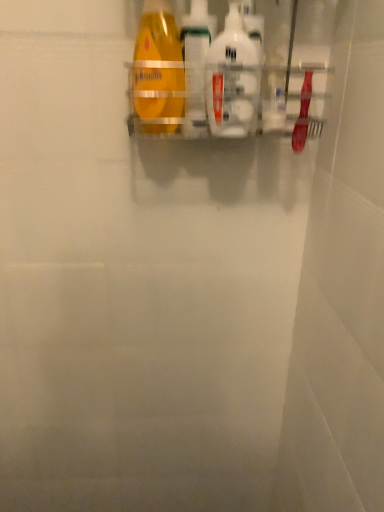
What is the approximate height of translucent plastic bottle at center, which is the second cleaning product in right-to-left order?

The height of translucent plastic bottle at center, which is the second cleaning product in right-to-left order, is 8.29 inches.

At what (x,y) coordinates should I click in order to perform the action: click on white glossy bottle at center, which appears as the 1th cleaning product when viewed from the right. Please return your answer as a coordinate pair (x, y). The image size is (384, 512). Looking at the image, I should click on (232, 79).

Describe the element at coordinates (158, 68) in the screenshot. This screenshot has width=384, height=512. I see `yellow matte bottle at upper center` at that location.

Locate an element on the screen. The height and width of the screenshot is (512, 384). translucent plastic bottle at center, the 1th cleaning product in the left-to-right sequence is located at coordinates (196, 65).

Would you say translucent plastic bottle at center, the 1th cleaning product in the left-to-right sequence, is inside or outside yellow matte bottle at upper center?

translucent plastic bottle at center, the 1th cleaning product in the left-to-right sequence, is spatially situated outside yellow matte bottle at upper center.

Can you tell me how much translucent plastic bottle at center, the 1th cleaning product in the left-to-right sequence, and yellow matte bottle at upper center differ in facing direction?

translucent plastic bottle at center, the 1th cleaning product in the left-to-right sequence, and yellow matte bottle at upper center are facing 45 degrees away from each other.

This screenshot has width=384, height=512. In order to click on bottle in front of the translucent plastic bottle at center, the 1th cleaning product in the left-to-right sequence in this screenshot , I will do `click(158, 68)`.

Is point (203, 60) positioned in front of point (145, 71)?

No, (203, 60) is behind (145, 71).

Can you confirm if yellow matte bottle at upper center is shorter than white glossy bottle at center, the second cleaning product in the left-to-right sequence?

No, yellow matte bottle at upper center is not shorter than white glossy bottle at center, the second cleaning product in the left-to-right sequence.

Considering the sizes of yellow matte bottle at upper center and white glossy bottle at center, the second cleaning product in the left-to-right sequence, in the image, is yellow matte bottle at upper center wider or thinner than white glossy bottle at center, the second cleaning product in the left-to-right sequence,?

In the image, yellow matte bottle at upper center appears to be wider than white glossy bottle at center, the second cleaning product in the left-to-right sequence.

Is yellow matte bottle at upper center aimed at white glossy bottle at center, which appears as the 1th cleaning product when viewed from the right?

No, yellow matte bottle at upper center does not turn towards white glossy bottle at center, which appears as the 1th cleaning product when viewed from the right.

Does point (160, 36) appear closer or farther from the camera than point (225, 27)?

Point (160, 36) is farther from the camera than point (225, 27).

From a real-world perspective, relative to white glossy bottle at center, which appears as the 1th cleaning product when viewed from the right, is translucent plastic bottle at center, the 1th cleaning product in the left-to-right sequence, vertically above or below?

translucent plastic bottle at center, the 1th cleaning product in the left-to-right sequence, is above white glossy bottle at center, which appears as the 1th cleaning product when viewed from the right.

The height and width of the screenshot is (512, 384). Find the location of `cleaning product that is below the translucent plastic bottle at center, the 1th cleaning product in the left-to-right sequence (from the image's perspective)`. cleaning product that is below the translucent plastic bottle at center, the 1th cleaning product in the left-to-right sequence (from the image's perspective) is located at coordinates (232, 79).

Which point is more forward, (191, 40) or (229, 98)?

→ Positioned in front is point (229, 98).

Does translucent plastic bottle at center, the 1th cleaning product in the left-to-right sequence, turn towards white glossy bottle at center, the second cleaning product in the left-to-right sequence?

No, translucent plastic bottle at center, the 1th cleaning product in the left-to-right sequence, is not facing towards white glossy bottle at center, the second cleaning product in the left-to-right sequence.

From the image's perspective, is yellow matte bottle at upper center over translucent plastic bottle at center, the 1th cleaning product in the left-to-right sequence?

Incorrect, from the image's perspective, yellow matte bottle at upper center is lower than translucent plastic bottle at center, the 1th cleaning product in the left-to-right sequence.

From a real-world perspective, which is physically above, yellow matte bottle at upper center or translucent plastic bottle at center, which is the second cleaning product in right-to-left order?

yellow matte bottle at upper center is physically above.

Is yellow matte bottle at upper center thinner than translucent plastic bottle at center, which is the second cleaning product in right-to-left order?

In fact, yellow matte bottle at upper center might be wider than translucent plastic bottle at center, which is the second cleaning product in right-to-left order.

Looking at this image, can translucent plastic bottle at center, which is the second cleaning product in right-to-left order, be found inside yellow matte bottle at upper center?

No, translucent plastic bottle at center, which is the second cleaning product in right-to-left order, is located outside of yellow matte bottle at upper center.

Based on the photo, can you tell me how much white glossy bottle at center, which appears as the 1th cleaning product when viewed from the right, and translucent plastic bottle at center, the 1th cleaning product in the left-to-right sequence, differ in facing direction?

0.00226 degrees separate the facing orientations of white glossy bottle at center, which appears as the 1th cleaning product when viewed from the right, and translucent plastic bottle at center, the 1th cleaning product in the left-to-right sequence.

Would you say translucent plastic bottle at center, the 1th cleaning product in the left-to-right sequence, is part of white glossy bottle at center, the second cleaning product in the left-to-right sequence,'s contents?

No, white glossy bottle at center, the second cleaning product in the left-to-right sequence, does not contain translucent plastic bottle at center, the 1th cleaning product in the left-to-right sequence.

Consider the image. Can you confirm if white glossy bottle at center, the second cleaning product in the left-to-right sequence, is bigger than translucent plastic bottle at center, the 1th cleaning product in the left-to-right sequence?

No.

Between white glossy bottle at center, which appears as the 1th cleaning product when viewed from the right, and yellow matte bottle at upper center, which one has smaller size?

white glossy bottle at center, which appears as the 1th cleaning product when viewed from the right, is smaller.

From the image's perspective, which is above, white glossy bottle at center, the second cleaning product in the left-to-right sequence, or yellow matte bottle at upper center?

From the image's view, yellow matte bottle at upper center is above.

Is point (246, 102) positioned in front of point (139, 60)?

Yes, it is.

Which cleaning product is the 2nd one when counting from the back of the yellow matte bottle at upper center? Please provide its 2D coordinates.

[(196, 65)]

I want to click on bottle on the left of white glossy bottle at center, which appears as the 1th cleaning product when viewed from the right, so (158, 68).

Based on their spatial positions, is white glossy bottle at center, which appears as the 1th cleaning product when viewed from the right, or yellow matte bottle at upper center further from translucent plastic bottle at center, the 1th cleaning product in the left-to-right sequence?

white glossy bottle at center, which appears as the 1th cleaning product when viewed from the right, is positioned further to the anchor translucent plastic bottle at center, the 1th cleaning product in the left-to-right sequence.

Considering their positions, is white glossy bottle at center, the second cleaning product in the left-to-right sequence, positioned closer to yellow matte bottle at upper center than translucent plastic bottle at center, which is the second cleaning product in right-to-left order?

Among the two, translucent plastic bottle at center, which is the second cleaning product in right-to-left order, is located nearer to yellow matte bottle at upper center.

Estimate the real-world distances between objects in this image. Which object is closer to white glossy bottle at center, which appears as the 1th cleaning product when viewed from the right, yellow matte bottle at upper center or translucent plastic bottle at center, the 1th cleaning product in the left-to-right sequence?

translucent plastic bottle at center, the 1th cleaning product in the left-to-right sequence, is closer to white glossy bottle at center, which appears as the 1th cleaning product when viewed from the right.

When comparing their distances from translucent plastic bottle at center, the 1th cleaning product in the left-to-right sequence, does yellow matte bottle at upper center or white glossy bottle at center, the second cleaning product in the left-to-right sequence, seem closer?

Based on the image, yellow matte bottle at upper center appears to be nearer to translucent plastic bottle at center, the 1th cleaning product in the left-to-right sequence.

Estimate the real-world distances between objects in this image. Which object is closer to yellow matte bottle at upper center, translucent plastic bottle at center, which is the second cleaning product in right-to-left order, or white glossy bottle at center, the second cleaning product in the left-to-right sequence?

The object closer to yellow matte bottle at upper center is translucent plastic bottle at center, which is the second cleaning product in right-to-left order.

Based on their spatial positions, is translucent plastic bottle at center, which is the second cleaning product in right-to-left order, or yellow matte bottle at upper center further from white glossy bottle at center, which appears as the 1th cleaning product when viewed from the right?

Based on the image, yellow matte bottle at upper center appears to be further to white glossy bottle at center, which appears as the 1th cleaning product when viewed from the right.

The width and height of the screenshot is (384, 512). I want to click on cleaning product between yellow matte bottle at upper center and white glossy bottle at center, which appears as the 1th cleaning product when viewed from the right, so click(x=196, y=65).